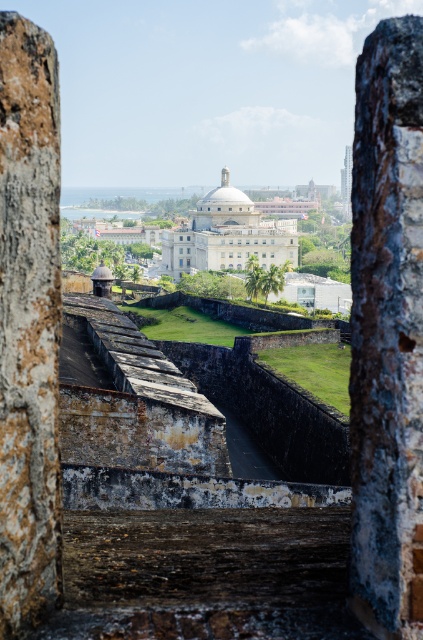
Where is `transparent glass window at center`? Image resolution: width=423 pixels, height=640 pixels. transparent glass window at center is located at coordinates (181, 260).

In the scene shown: Can you confirm if transparent glass window at center is thinner than white glass window at center?

No, transparent glass window at center is not thinner than white glass window at center.

Which is behind, point (181, 259) or point (180, 250)?

Point (181, 259)

Find the location of a particular element. The width and height of the screenshot is (423, 640). transparent glass window at center is located at coordinates (181, 260).

Describe the element at coordinates (227, 236) in the screenshot. I see `white smooth building at center` at that location.

What do you see at coordinates (227, 236) in the screenshot?
I see `white smooth building at center` at bounding box center [227, 236].

Find the location of a particular element. This screenshot has width=423, height=640. white smooth building at center is located at coordinates (227, 236).

Consider the image. Is white smooth building at center below smooth concrete tower at center?

Indeed, white smooth building at center is positioned under smooth concrete tower at center.

Can you confirm if white smooth building at center is positioned to the right of smooth concrete tower at center?

Incorrect, white smooth building at center is not on the right side of smooth concrete tower at center.

Locate an element on the screen. white smooth building at center is located at coordinates pos(227,236).